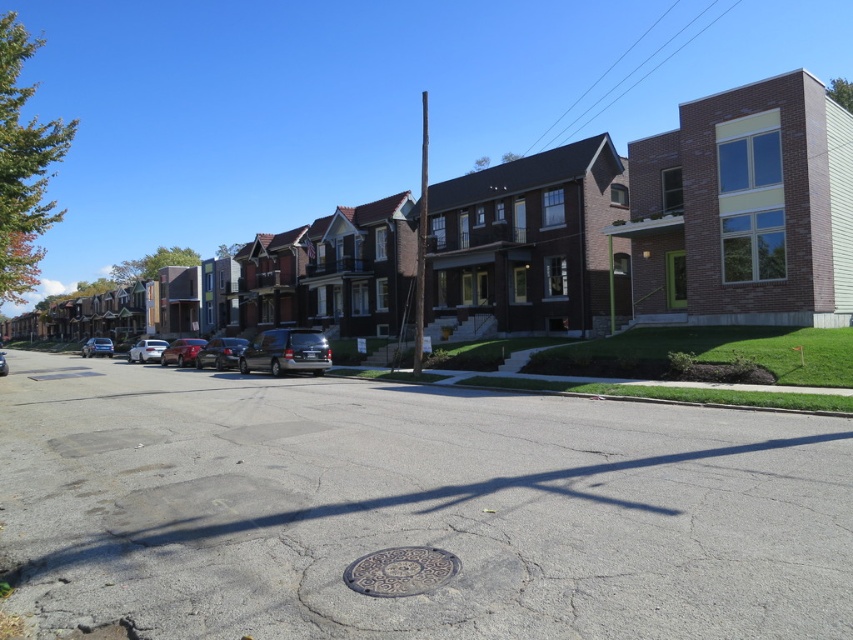
You are a delivery driver trying to park your vehicle between the two sedans on the residential street. The satin black sedan at center and the shiny silver sedan at center are both parked along the street. Which direction should you turn to park between them?

The satin black sedan at center is positioned on the right side of the shiny silver sedan at center, so you should turn left to park between them.

You are a delivery driver trying to park your vehicle, which is 0.5 meters thick, in this residential area. There is a gold textured manhole cover at center and a satin black sedan at center blocking the street. Can your vehicle fit through the space between them?

The gold textured manhole cover at center is thinner than the satin black sedan at center. Since your vehicle is 0.5 meters thick, it can fit through the space between them as the manhole cover is thinner, providing enough clearance.